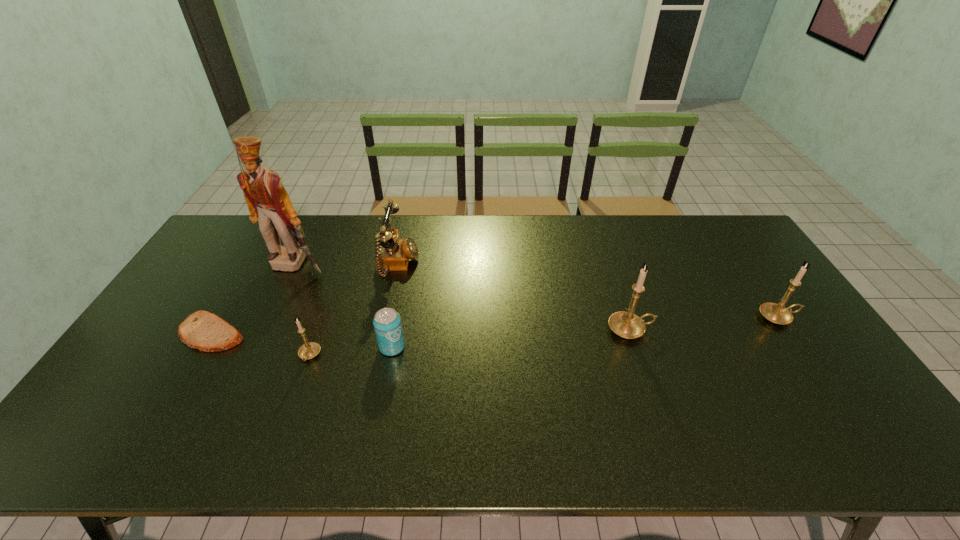
At what (x,y) coordinates should I click in order to perform the action: click on the fifth object from right to left. Please return your answer as a coordinate pair (x, y). Looking at the image, I should click on (309, 350).

I want to click on the shortest candle holder, so click(309, 350).

In order to click on the second object from right to left in this screenshot , I will do `click(625, 324)`.

The height and width of the screenshot is (540, 960). I want to click on the rightmost candle holder, so click(x=776, y=313).

This screenshot has width=960, height=540. I want to click on the rightmost object, so click(x=776, y=313).

Where is `nutcracker`? Image resolution: width=960 pixels, height=540 pixels. nutcracker is located at coordinates (268, 202).

Locate an element on the screen. The width and height of the screenshot is (960, 540). the shortest object is located at coordinates (202, 330).

This screenshot has height=540, width=960. Identify the location of telephone. (393, 254).

You are a GUI agent. You are given a task and a screenshot of the screen. Output one action in this format:
    pyautogui.click(x=<x>, y=<y>)
    Task: Click on the beer can
    
    Given the screenshot: What is the action you would take?
    pyautogui.click(x=387, y=324)

Identify the location of free spot located on the handle side of the shortest candle holder. (290, 410).